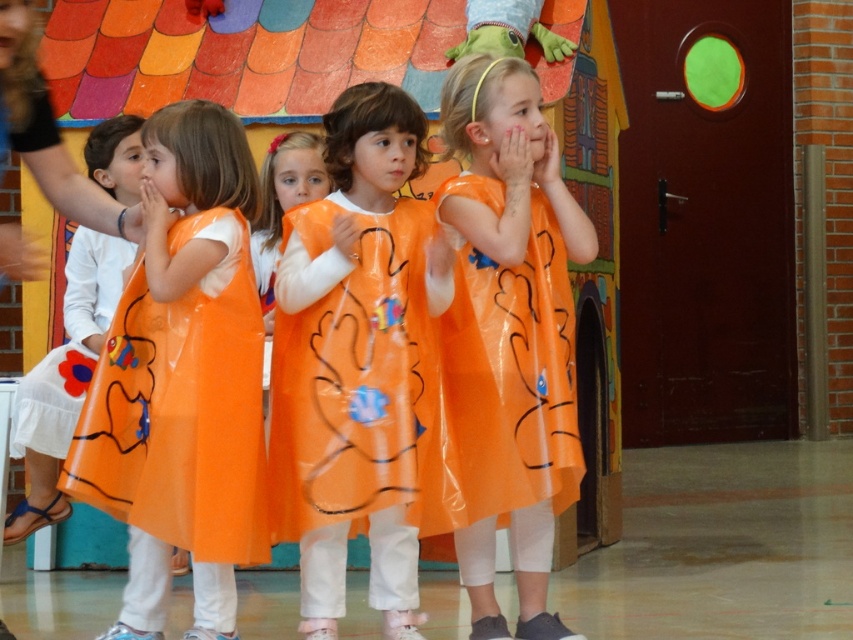
Can you confirm if transparent orange dress at center is shorter than orange plastic dress at center?

Indeed, transparent orange dress at center has a lesser height compared to orange plastic dress at center.

Which is in front, point (379, 412) or point (460, 392)?

Positioned in front is point (379, 412).

The image size is (853, 640). Find the location of `transparent orange dress at center`. transparent orange dress at center is located at coordinates (352, 371).

Is transparent orange dress at center bigger than orange translucent dress at center?

Yes, transparent orange dress at center is bigger than orange translucent dress at center.

Does transparent orange dress at center appear over orange translucent dress at center?

Indeed, transparent orange dress at center is positioned over orange translucent dress at center.

This screenshot has height=640, width=853. Describe the element at coordinates (352, 371) in the screenshot. I see `transparent orange dress at center` at that location.

Where is `transparent orange dress at center`? transparent orange dress at center is located at coordinates (352, 371).

Is orange translucent dress at center closer to camera compared to orange plastic dress at center?

Yes, it is.

Who is higher up, orange translucent dress at center or orange plastic dress at center?

orange plastic dress at center is above.

Is point (210, 349) closer to camera compared to point (527, 346)?

Yes, it is in front of point (527, 346).

Where is `orange translucent dress at center`? This screenshot has width=853, height=640. orange translucent dress at center is located at coordinates (178, 413).